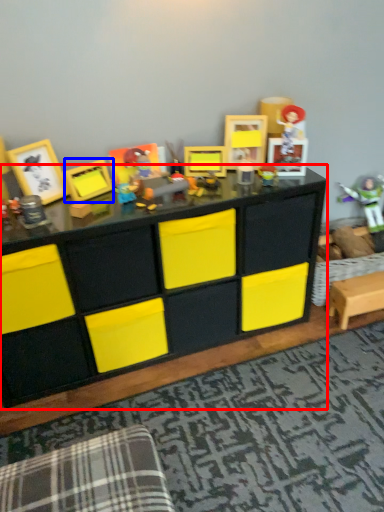
Question: Which of the following is the farthest to the observer, table (highlighted by a red box) or picture frame (highlighted by a blue box)?

Choices:
 (A) table
 (B) picture frame

Answer: (B)